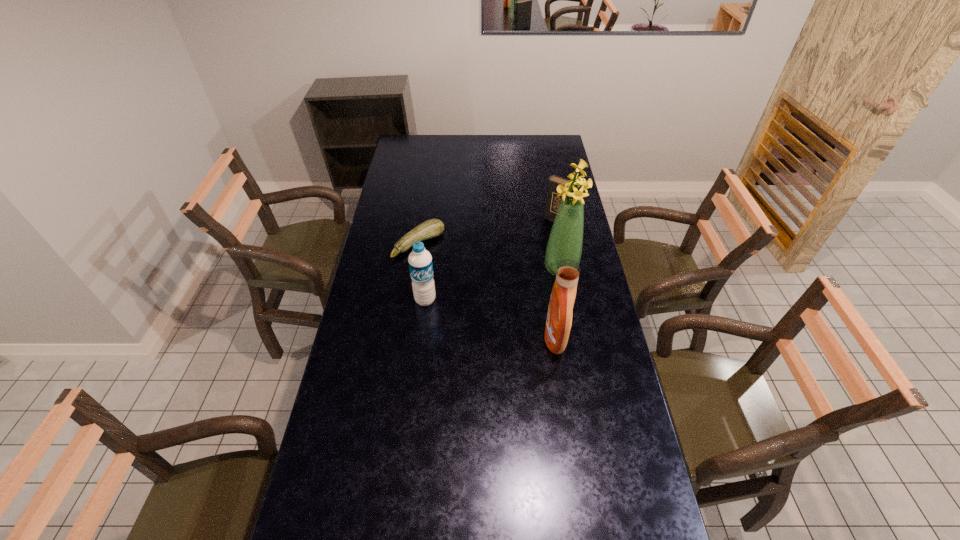
Locate an element on the screen. free space between the shortest object and the tallest object is located at coordinates (490, 256).

Locate an element on the screen. free space between the third shortest object and the fourth shortest object is located at coordinates (491, 319).

I want to click on blank region between the water bottle and the second shortest object, so click(x=493, y=261).

Where is `vacant region between the shortest object and the detergent`? vacant region between the shortest object and the detergent is located at coordinates (487, 292).

Identify which object is the second nearest to the fourth tallest object. Please provide its 2D coordinates. Your answer should be formatted as a tuple, i.e. [(x, y)], where the tuple contains the x and y coordinates of a point satisfying the conditions above.

[(431, 228)]

You are a GUI agent. You are given a task and a screenshot of the screen. Output one action in this format:
    pyautogui.click(x=<x>, y=<y>)
    Task: Click on the fourth closest object relative to the second shortest object
    This screenshot has width=960, height=540.
    Given the screenshot: What is the action you would take?
    pyautogui.click(x=420, y=263)

Image resolution: width=960 pixels, height=540 pixels. Find the location of `free point that satisfies the following two spatial constraints: 1. on the label of the nearest object; 2. on the front-facing side of the third shortest object`. free point that satisfies the following two spatial constraints: 1. on the label of the nearest object; 2. on the front-facing side of the third shortest object is located at coordinates coord(421,338).

You are a GUI agent. You are given a task and a screenshot of the screen. Output one action in this format:
    pyautogui.click(x=<x>, y=<y>)
    Task: Click on the free space that satisfies the following two spatial constraints: 1. on the label of the nearest object; 2. on the front-facing side of the fourth farthest object
    Image resolution: width=960 pixels, height=540 pixels.
    Given the screenshot: What is the action you would take?
    pyautogui.click(x=421, y=338)

Identify the location of free location that satisfies the following two spatial constraints: 1. on the front side of the nearest object; 2. on the front-facing side of the zucchini. (405, 338).

I want to click on vacant point that satisfies the following two spatial constraints: 1. on the label of the nearest object; 2. on the front-facing side of the second nearest object, so click(x=421, y=338).